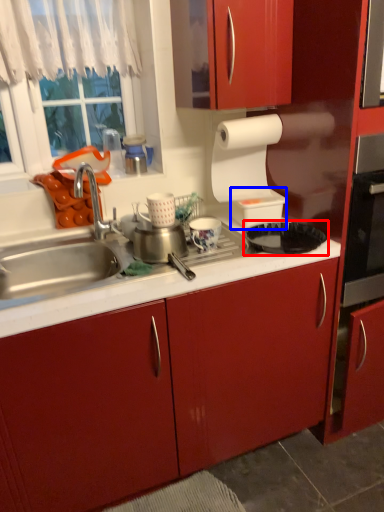
Question: Which point is further to the camera, kitchen appliance (highlighted by a red box) or appliance (highlighted by a blue box)?

Choices:
 (A) kitchen appliance
 (B) appliance

Answer: (B)